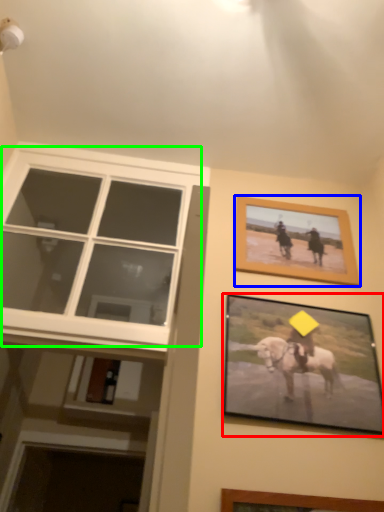
Question: Estimate the real-world distances between objects in this image. Which object is closer to picture frame (highlighted by a red box), picture frame (highlighted by a blue box) or window (highlighted by a green box)?

Choices:
 (A) picture frame
 (B) window

Answer: (A)